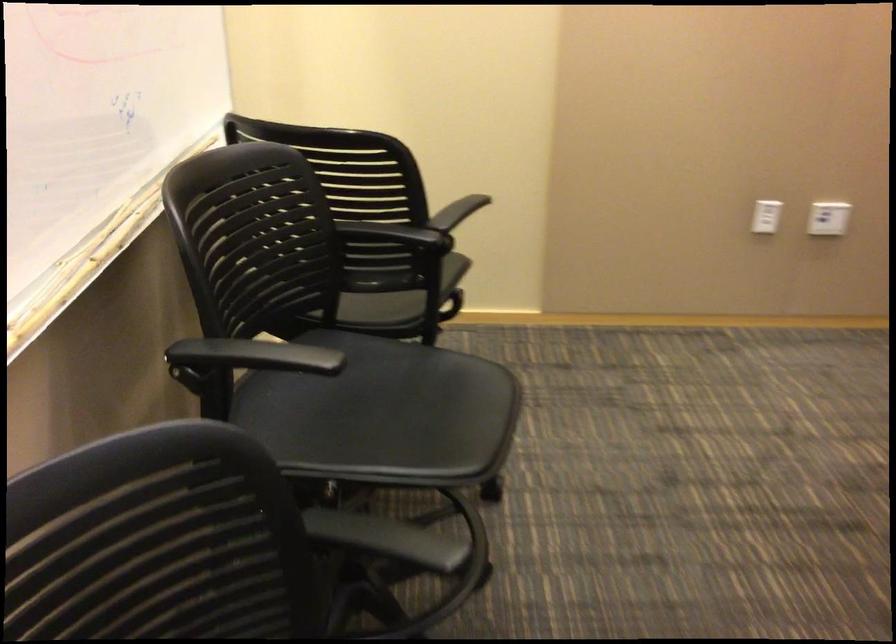
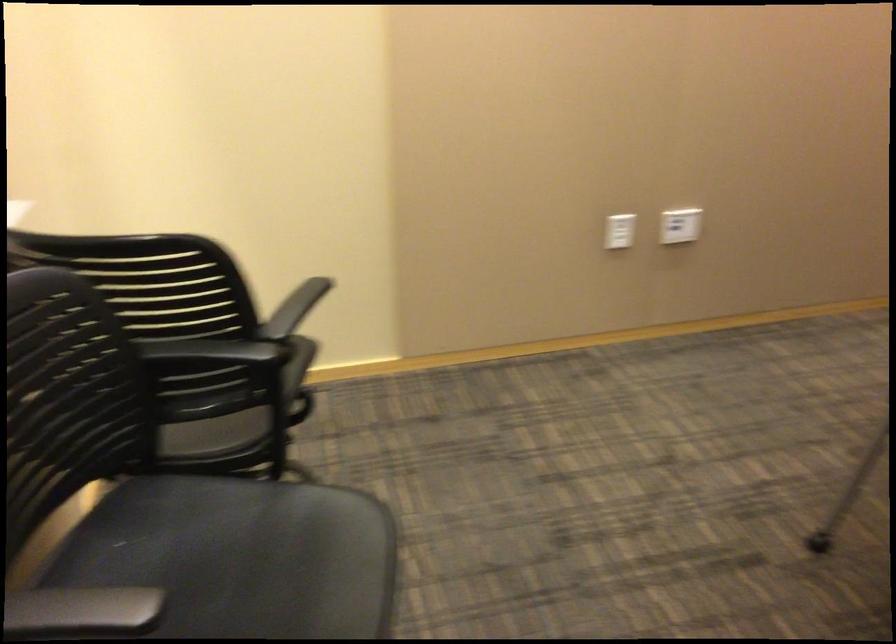
Question: The camera is either moving clockwise (left) or counter-clockwise (right) around the object. The first image is from the beginning of the video and the second image is from the end. Is the camera moving left or right when shooting the video?

Choices:
 (A) Left
 (B) Right

Answer: (A)